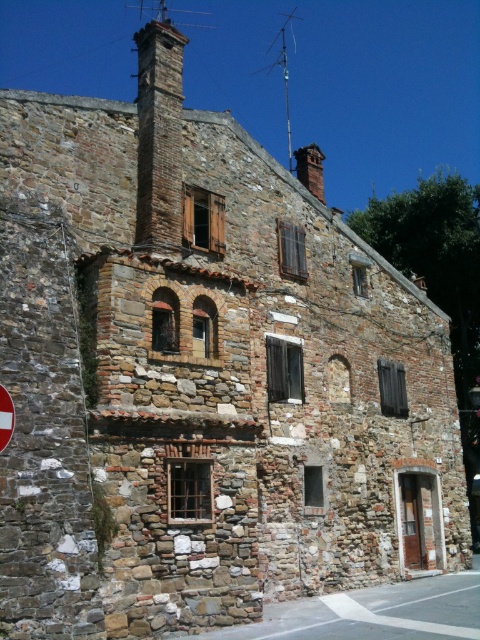
Question: Based on their relative distances, which object is farther from the metallic antenna at upper center?

Choices:
 (A) red brick chimney at upper center
 (B) brown stone chimney at upper center

Answer: (B)

Question: Is red plastic stop sign at left positioned at the back of metallic antenna at upper center?

Choices:
 (A) yes
 (B) no

Answer: (B)

Question: Is brown stone chimney at upper center bigger than metallic antenna at upper center?

Choices:
 (A) yes
 (B) no

Answer: (A)

Question: Among these objects, which one is nearest to the camera?

Choices:
 (A) metallic antenna at upper center
 (B) brown stone chimney at upper center

Answer: (B)

Question: Where is brown stone chimney at upper center located in relation to metallic antenna at upper center in the image?

Choices:
 (A) below
 (B) above

Answer: (A)

Question: Which point is farther from the camera taking this photo?

Choices:
 (A) (307, 179)
 (B) (171, 172)

Answer: (A)